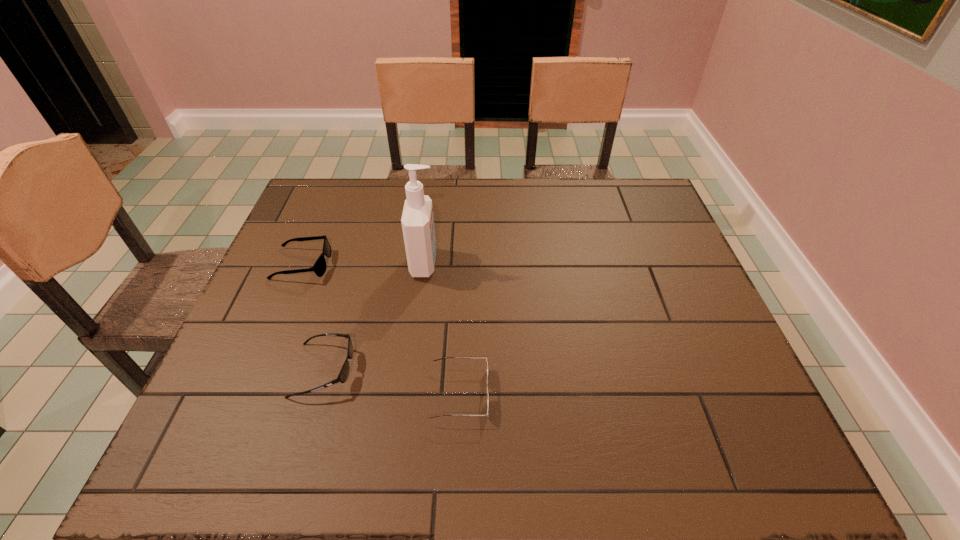
Where is `vacant area situated on the front-facing side of the rightmost object`? vacant area situated on the front-facing side of the rightmost object is located at coordinates [676, 394].

The height and width of the screenshot is (540, 960). Find the location of `vacant space at the far edge of the desktop`. vacant space at the far edge of the desktop is located at coordinates (384, 188).

At what (x,y) coordinates should I click in order to perform the action: click on vacant point at the near edge. Please return your answer as a coordinate pair (x, y). The image size is (960, 540). Looking at the image, I should click on (345, 462).

Where is `vacant space at the left edge of the desktop`? The width and height of the screenshot is (960, 540). vacant space at the left edge of the desktop is located at coordinates (285, 381).

Identify the location of vacant space at the right edge. The height and width of the screenshot is (540, 960). (735, 375).

Identify the location of vacant space at the far left corner of the desktop. This screenshot has width=960, height=540. (349, 179).

In the image, there is a desktop. Where is `free space at the near left corner`? free space at the near left corner is located at coordinates (217, 430).

Where is `vacant space at the far right corner`? This screenshot has height=540, width=960. vacant space at the far right corner is located at coordinates (609, 180).

You are a GUI agent. You are given a task and a screenshot of the screen. Output one action in this format:
    pyautogui.click(x=<x>, y=<y>)
    Task: Click on the vacant point located between the tallest object and the rightmost sunglasses
    This screenshot has height=540, width=960.
    Given the screenshot: What is the action you would take?
    pyautogui.click(x=443, y=328)

This screenshot has width=960, height=540. I want to click on free space between the second sunglasses from left to right and the leftmost object, so click(x=313, y=317).